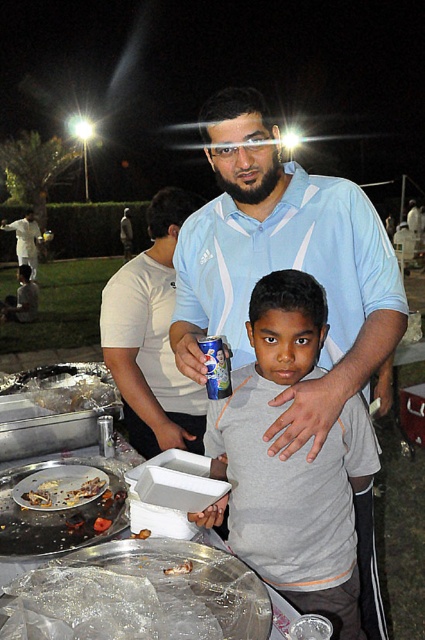
Can you confirm if matte white shirt at center is wider than brown crispy chicken at lower left?

Indeed, matte white shirt at center has a greater width compared to brown crispy chicken at lower left.

Who is more distant from viewer, (201, 436) or (50, 484)?

The point (201, 436) is behind.

The width and height of the screenshot is (425, 640). What do you see at coordinates (152, 337) in the screenshot? I see `matte white shirt at center` at bounding box center [152, 337].

The width and height of the screenshot is (425, 640). I want to click on matte white shirt at center, so click(152, 337).

Is matte white shirt at center smaller than matte black laptop at left?

Correct, matte white shirt at center occupies less space than matte black laptop at left.

Does matte white shirt at center have a greater width compared to matte black laptop at left?

In fact, matte white shirt at center might be narrower than matte black laptop at left.

I want to click on matte white shirt at center, so click(x=152, y=337).

Identify the location of matte white shirt at center. (152, 337).

Does brown crispy chicken at lower left lie in front of matte black laptop at left?

Yes.

Is brown crispy chicken at lower left to the right of matte black laptop at left from the viewer's perspective?

Indeed, brown crispy chicken at lower left is positioned on the right side of matte black laptop at left.

Does point (68, 490) lie in front of point (16, 308)?

Yes, point (68, 490) is in front of point (16, 308).

This screenshot has height=640, width=425. I want to click on brown crispy chicken at lower left, so click(x=84, y=492).